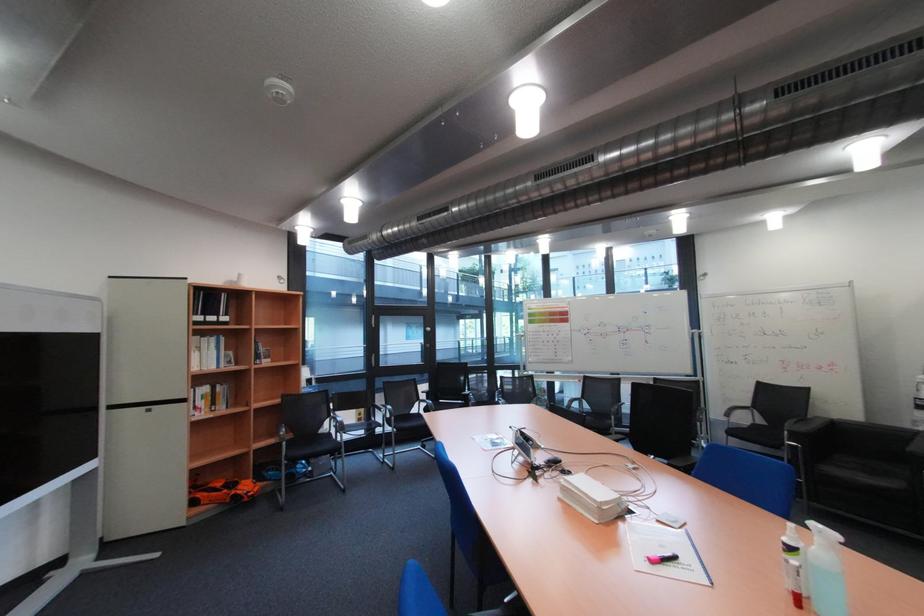
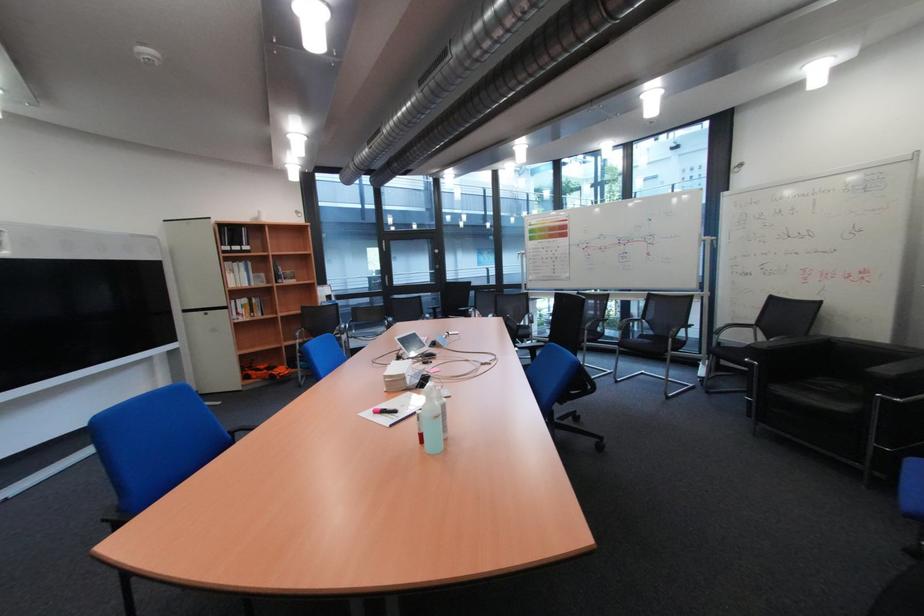
Question: In a continuous first-person perspective shot, in which direction is the camera moving?

Choices:
 (A) Left
 (B) Right
 (C) Forward
 (D) Backward

Answer: (B)